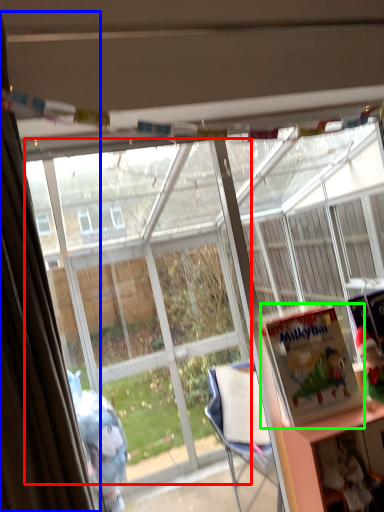
Question: Estimate the real-world distances between objects in this image. Which object is farther from bay window (highlighted by a red box), curtain (highlighted by a blue box) or book (highlighted by a green box)?

Choices:
 (A) curtain
 (B) book

Answer: (A)